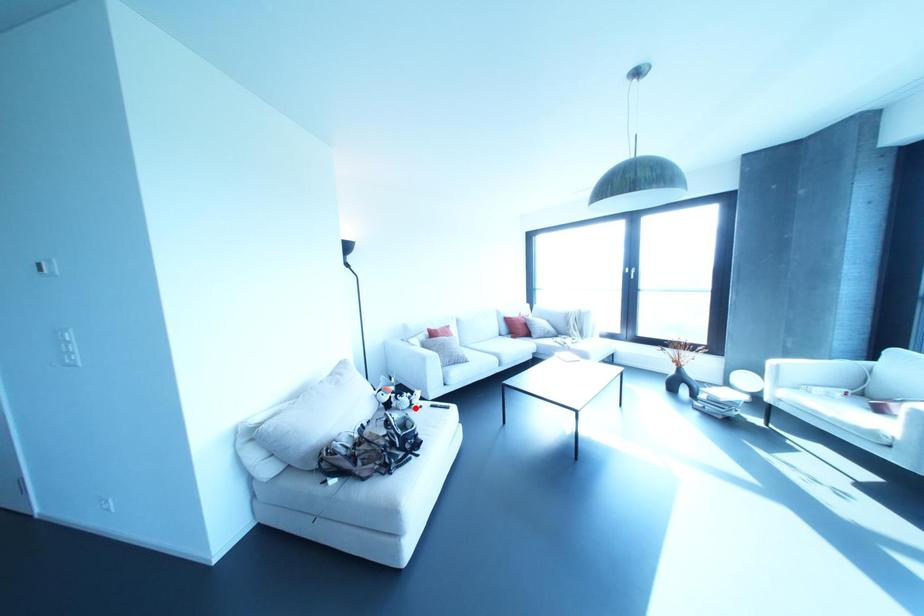
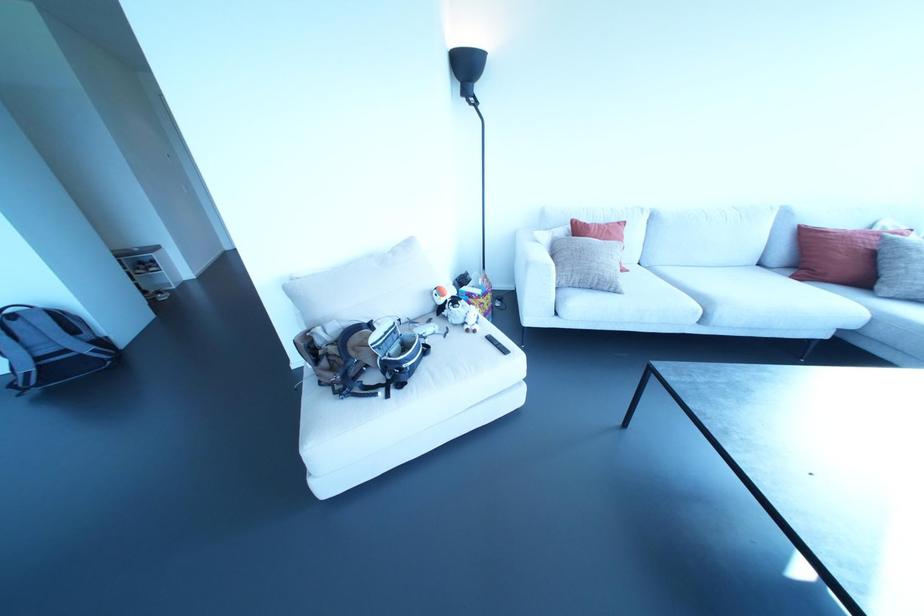
The point at the highlighted location is marked in the first image. Where is the corresponding point in the second image?

(467, 330)